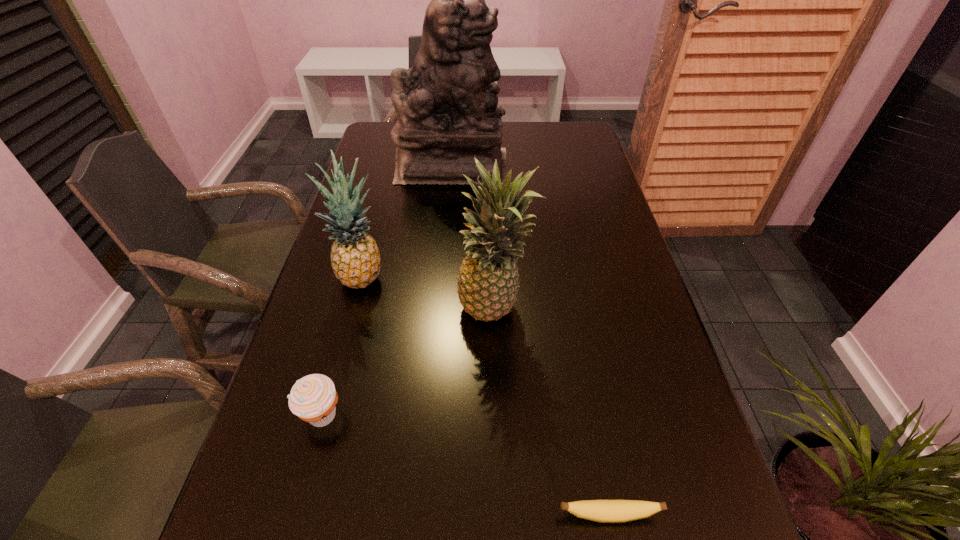
You are a GUI agent. You are given a task and a screenshot of the screen. Output one action in this format:
    pyautogui.click(x=<x>, y=<y>)
    Task: Click on the free spot that satisfies the following two spatial constraints: 1. on the front side of the banana; 2. on the right side of the right pineapple
    Image resolution: width=960 pixels, height=540 pixels.
    Given the screenshot: What is the action you would take?
    pyautogui.click(x=500, y=515)

You are a GUI agent. You are given a task and a screenshot of the screen. Output one action in this format:
    pyautogui.click(x=<x>, y=<y>)
    Task: Click on the free space that satisfies the following two spatial constraints: 1. on the front-facing side of the tallest object; 2. on the front side of the muffin
    
    Given the screenshot: What is the action you would take?
    pyautogui.click(x=431, y=415)

You are a GUI agent. You are given a task and a screenshot of the screen. Output one action in this format:
    pyautogui.click(x=<x>, y=<y>)
    Task: Click on the blank area in the image that satisfies the following two spatial constraints: 1. on the back side of the right pineapple; 2. on the left side of the muffin
    
    Given the screenshot: What is the action you would take?
    pyautogui.click(x=349, y=311)